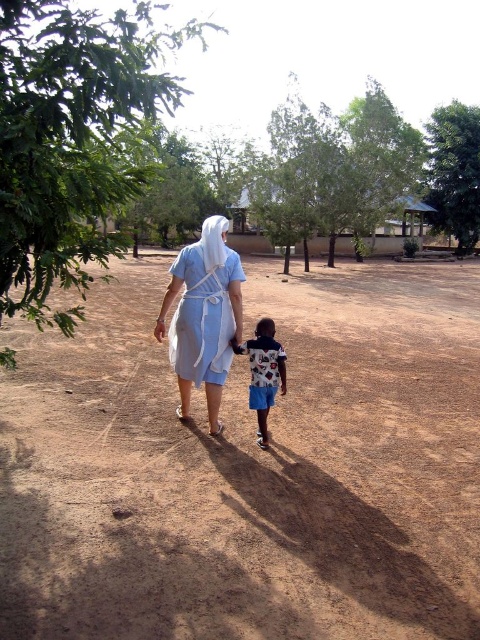
Question: Does green leafy tree at left have a larger size compared to matte blue dress at center?

Choices:
 (A) no
 (B) yes

Answer: (B)

Question: Which of the following is the farthest from the observer?

Choices:
 (A) [x=11, y=522]
 (B) [x=257, y=330]
 (C) [x=200, y=246]
 (D) [x=35, y=289]

Answer: (C)

Question: Which object appears farthest from the camera in this image?

Choices:
 (A) green leafy tree at left
 (B) matte blue dress at center
 (C) brown sandy ground at center

Answer: (B)

Question: Which of the following is the farthest from the observer?

Choices:
 (A) matte blue dress at center
 (B) printed cotton shirt at center
 (C) green leafy tree at upper right

Answer: (C)

Question: Can you confirm if matte blue dress at center is positioned to the right of printed cotton shirt at center?

Choices:
 (A) yes
 (B) no

Answer: (B)

Question: Is green leafy tree at left wider than green leafy tree at upper right?

Choices:
 (A) yes
 (B) no

Answer: (A)